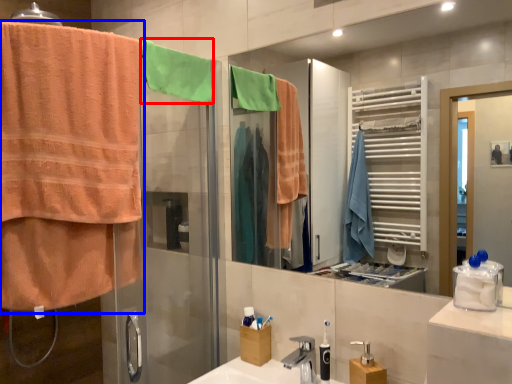
Question: Which object appears farthest to the camera in this image, beach towel (highlighted by a red box) or towel (highlighted by a blue box)?

Choices:
 (A) beach towel
 (B) towel

Answer: (A)